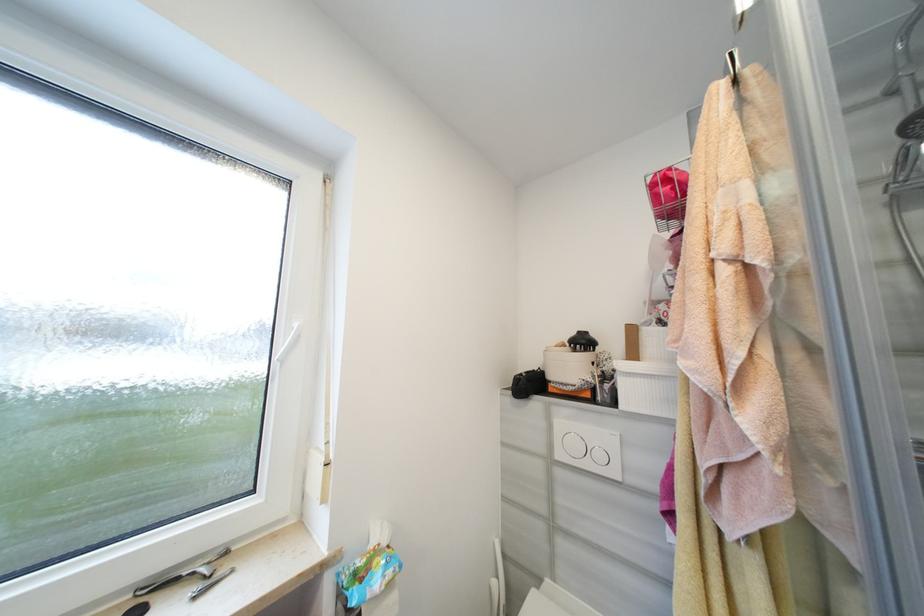
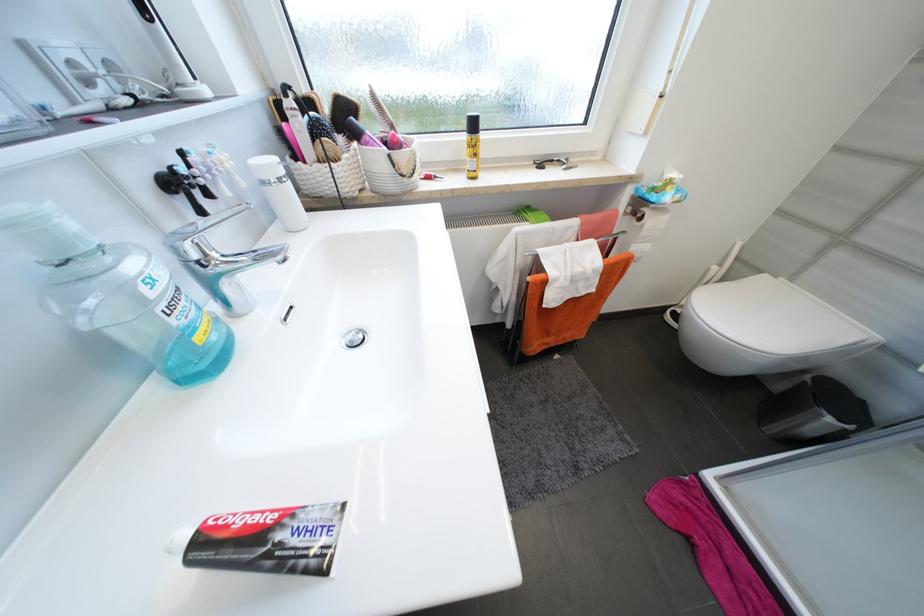
Locate, in the second image, the point that corresponds to the point at 185,580 in the first image.

(558, 161)